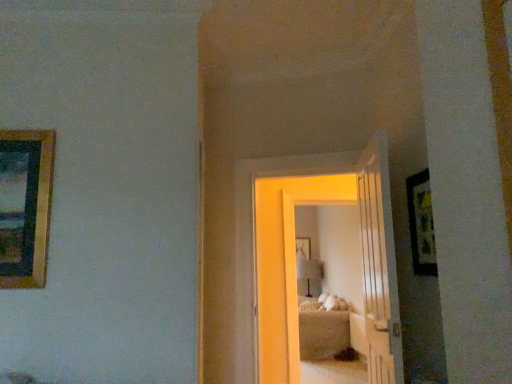
Question: In terms of size, does wooden framed picture at right, the second picture frame viewed from the right, appear bigger or smaller than gold-framed picture at left, positioned as the 1th picture frame in left-to-right order?

Choices:
 (A) big
 (B) small

Answer: (B)

Question: Based on their positions, is wooden framed picture at right, the second picture frame viewed from the right, located to the left or right of gold-framed picture at left, the second picture frame in the front-to-back sequence?

Choices:
 (A) right
 (B) left

Answer: (A)

Question: Which object is the closest to the wooden framed picture at right, the 1th picture frame viewed from the front?

Choices:
 (A) matte white lamp at center
 (B) white glossy door at center, placed as the 2th door when sorted from right to left
 (C) gold-framed picture at left, marked as the third picture frame in a right-to-left arrangement
 (D) white wooden door at center, the 2th door positioned from the left
 (E) wooden picture frame at center, acting as the 3th picture frame starting from the left

Answer: (D)

Question: Which object is positioned farthest from the white glossy door at center, the first door when ordered from left to right?

Choices:
 (A) matte white lamp at center
 (B) wooden picture frame at center, acting as the 3th picture frame starting from the front
 (C) wooden framed picture at right, the 1th picture frame viewed from the front
 (D) beige fabric bed at center
 (E) white wooden door at center, arranged as the first door when viewed from the right

Answer: (B)